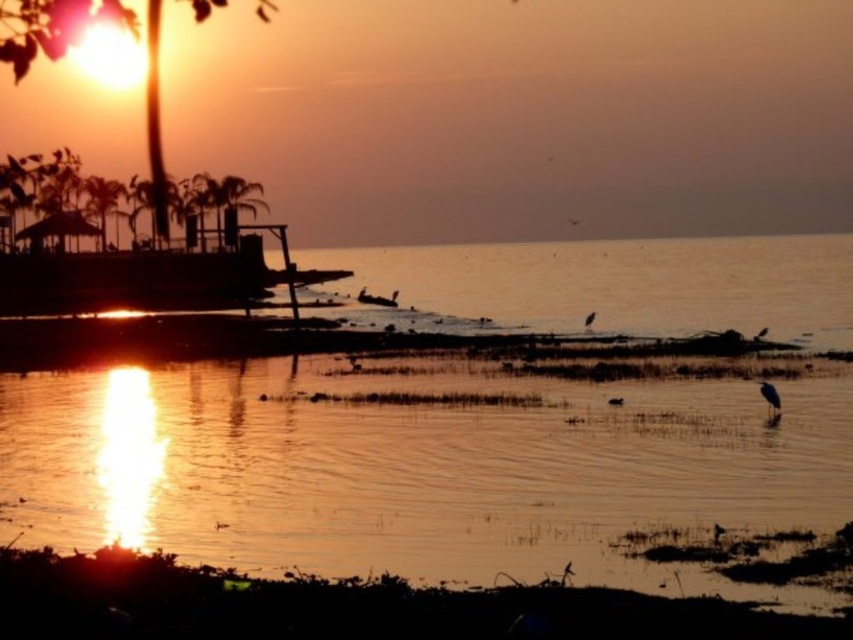
Who is more distant from viewer, (111, 205) or (766, 332)?

Point (111, 205)

Which of these two, green leafy palm tree at upper left or white matte bird at center, stands taller?

With more height is green leafy palm tree at upper left.

You are a GUI agent. You are given a task and a screenshot of the screen. Output one action in this format:
    pyautogui.click(x=<x>, y=<y>)
    Task: Click on the green leafy palm tree at upper left
    
    Given the screenshot: What is the action you would take?
    pyautogui.click(x=102, y=202)

Where is `green leafy palm tree at upper left`? The image size is (853, 640). green leafy palm tree at upper left is located at coordinates (102, 202).

Which is in front, point (77, 536) or point (357, 298)?

Point (77, 536)

Does point (51, 401) come behind point (357, 298)?

No.

Is point (460, 259) in front of point (380, 305)?

No, (460, 259) is behind (380, 305).

At what (x,y) coordinates should I click in order to perform the action: click on shiny golden water at center. Please return your answer as a coordinate pair (x, y). The height and width of the screenshot is (640, 853). Looking at the image, I should click on (416, 468).

Is the position of shiny golden water at center more distant than that of gray matte bird at lower right?

No, it is not.

Is point (596, 493) closer to camera compared to point (770, 392)?

Yes, point (596, 493) is in front of point (770, 392).

You are a GUI agent. You are given a task and a screenshot of the screen. Output one action in this format:
    pyautogui.click(x=<x>, y=<y>)
    Task: Click on the shiny golden water at center
    
    Given the screenshot: What is the action you would take?
    pyautogui.click(x=416, y=468)